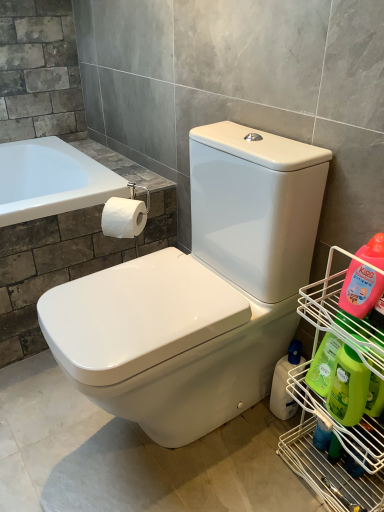
Question: Based on their sizes in the image, would you say metal wire rack at right is bigger or smaller than white matte toilet paper at upper left?

Choices:
 (A) big
 (B) small

Answer: (A)

Question: Is point (299, 391) closer or farther from the camera than point (117, 224)?

Choices:
 (A) closer
 (B) farther

Answer: (A)

Question: Estimate the real-world distances between objects in this image. Which object is closer to the pink plastic bottle at right, acting as the 1th cleaning product starting from the front?

Choices:
 (A) white matte toilet paper at upper left
 (B) metal wire rack at right
 (C) green plastic bottle at right, arranged as the 2th cleaning product when viewed from the back
 (D) translucent plastic bottle at lower right, the 4th cleaning product from the front
 (E) green matte bottle at lower right, the 3th cleaning product positioned from the back

Answer: (C)

Question: Which of these objects is positioned closest to the translucent plastic bottle at lower right, which is the 1th cleaning product in back-to-front order?

Choices:
 (A) white matte toilet paper at upper left
 (B) pink plastic bottle at right, acting as the 1th cleaning product starting from the front
 (C) metal wire rack at right
 (D) green matte bottle at lower right, the 3th cleaning product positioned from the back
 (E) green plastic bottle at right, arranged as the 2th cleaning product when viewed from the back

Answer: (C)